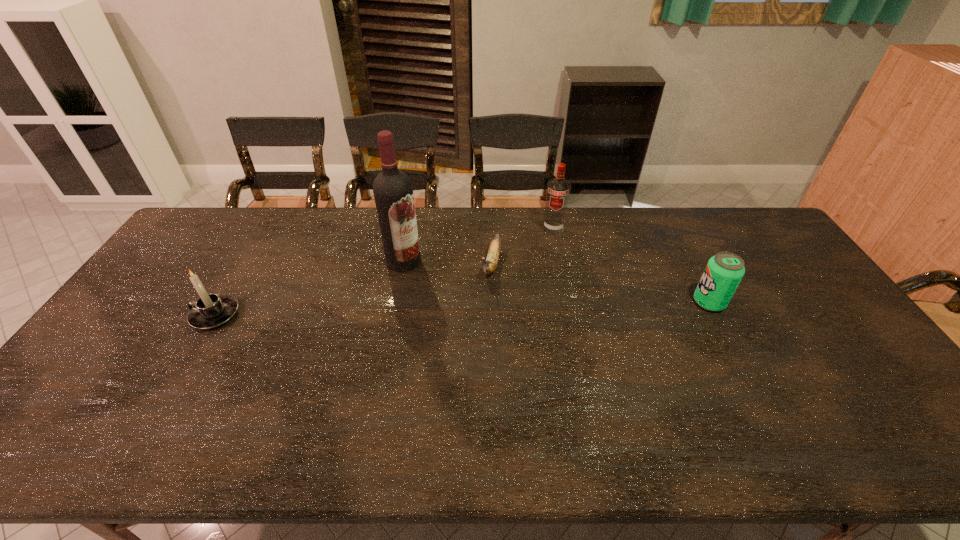
You are a GUI agent. You are given a task and a screenshot of the screen. Output one action in this format:
    pyautogui.click(x=<x>, y=<y>)
    Task: Click on the leftmost object
    The height and width of the screenshot is (540, 960).
    Given the screenshot: What is the action you would take?
    pyautogui.click(x=211, y=310)

Where is `the rightmost object`? This screenshot has width=960, height=540. the rightmost object is located at coordinates (724, 271).

Where is `the tallest object`? The image size is (960, 540). the tallest object is located at coordinates (393, 192).

You are a GUI agent. You are given a task and a screenshot of the screen. Output one action in this format:
    pyautogui.click(x=<x>, y=<y>)
    Task: Click on the second object from left to right
    The width and height of the screenshot is (960, 540).
    Given the screenshot: What is the action you would take?
    pyautogui.click(x=393, y=192)

You are a GUI agent. You are given a task and a screenshot of the screen. Output one action in this format:
    pyautogui.click(x=<x>, y=<y>)
    Task: Click on the vodka
    This screenshot has height=540, width=960.
    Given the screenshot: What is the action you would take?
    pyautogui.click(x=558, y=189)

Locate an element on the screen. the fourth shortest object is located at coordinates (558, 189).

The width and height of the screenshot is (960, 540). Find the location of `the shortest object`. the shortest object is located at coordinates (489, 266).

Identify the location of banana. (489, 266).

You are a GUI agent. You are given a task and a screenshot of the screen. Output one action in this format:
    pyautogui.click(x=<x>, y=<y>)
    Task: Click on the vacant space located 0.120m with a handle on the side of the leftmost object
    This screenshot has height=540, width=960.
    Given the screenshot: What is the action you would take?
    pyautogui.click(x=150, y=315)

What are the coordinates of `free space located 0.130m with a handle on the side of the leftmost object` in the screenshot? It's located at (147, 315).